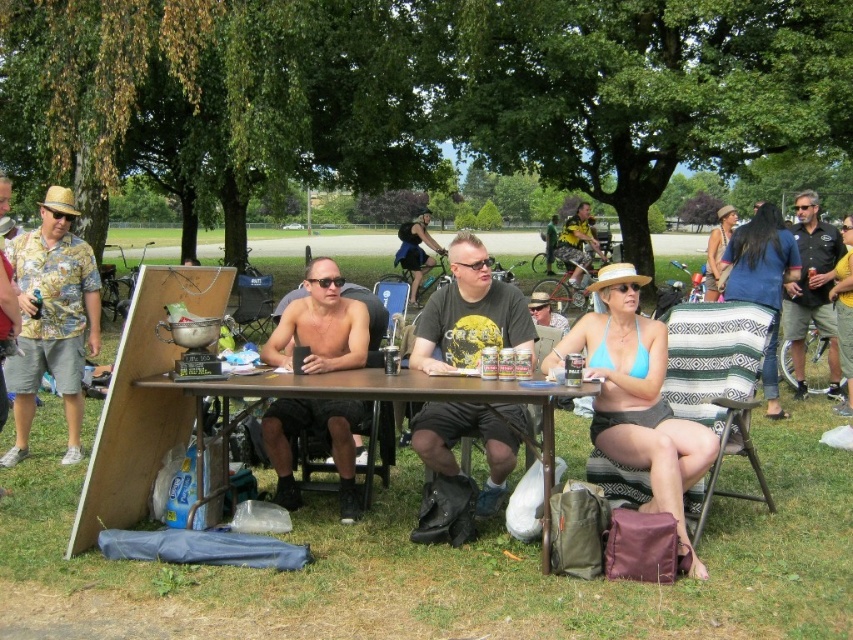
You are standing at the picnic table and want to hand a drink to both the person wearing the floral shirt at left and the person in the black leather jacket at upper right. Which one can you reach without moving from your spot?

The floral shirt at left is closer to the viewer, so you can reach the person wearing the floral shirt at left first without moving.

Looking at this image, you are planning to place a large rectangular gift box on the table. The gift box is wider than the floral shirt at left. Can it fit on the brown wooden table at center?

The brown wooden table at center is wider than the floral shirt at left. Since the gift box is wider than the floral shirt at left, it might still fit on the brown wooden table at center if its width is within the table dimensions. However, without knowing the exact size of the gift box relative to the table, we cannot confirm for certain.